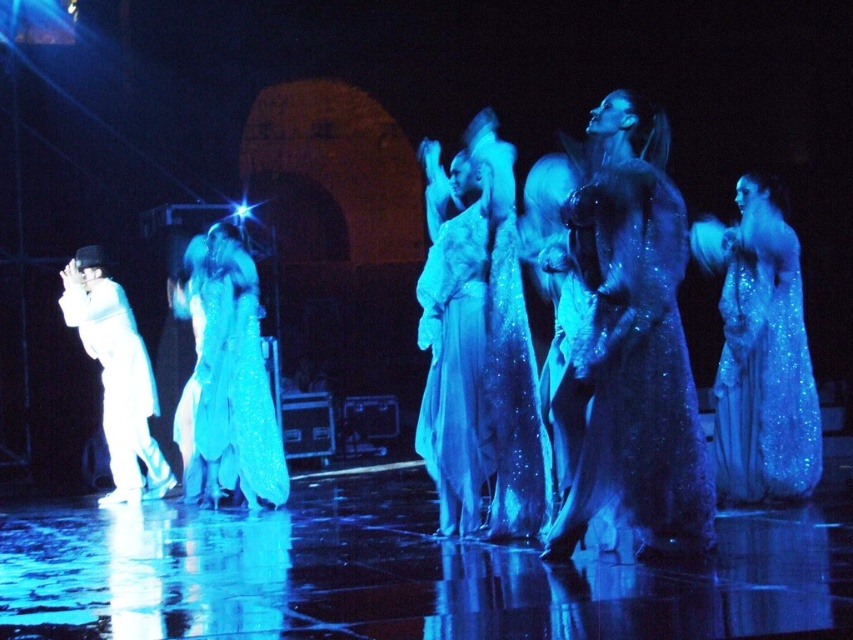
Question: Which object is positioned closest to the white glossy suit at left?

Choices:
 (A) sparkly blue dress at center
 (B) satin shimmering gown at center

Answer: (B)

Question: Which point appears closest to the camera in this image?

Choices:
 (A) (759, 348)
 (B) (96, 300)
 (C) (584, 504)

Answer: (C)

Question: Can you confirm if satin shimmering gown at center is positioned to the left of white glossy suit at left?

Choices:
 (A) yes
 (B) no

Answer: (B)

Question: Which of the following is the closest to the observer?

Choices:
 (A) white glossy suit at left
 (B) satin shimmering gown at center

Answer: (B)

Question: Considering the relative positions of satin shimmering gown at center and white glossy suit at left in the image provided, where is satin shimmering gown at center located with respect to white glossy suit at left?

Choices:
 (A) above
 (B) below

Answer: (A)

Question: Does sparkly blue dress at right lie in front of satin shimmering gown at center?

Choices:
 (A) no
 (B) yes

Answer: (B)